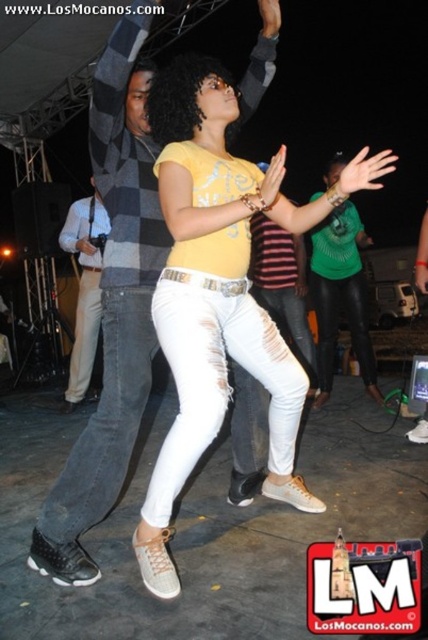
You are standing at the back of the dance floor and want to take a photo of the denim jeans at center and the green matte shirt at center. Which one will appear larger in your photo?

The denim jeans at center will appear larger in the photo because it is closer to the viewer than the green matte shirt at center.

You are at an outdoor event and see two people dancing. One is wearing denim jeans at center and the other is wearing a light blue shirt at left. From your perspective, which dancer is closer to you?

The denim jeans at center is in front of the light blue shirt at left, so the dancer wearing denim jeans at center is closer to you.

You are a photographer standing at the event. You want to capture a clear photo of the denim jeans at center. Considering your current position, is the distance sufficient to ensure the jeans are in focus?

The denim jeans at center are 1.65 meters away from the camera. This distance is typically sufficient for a clear photo, assuming proper focus adjustment.